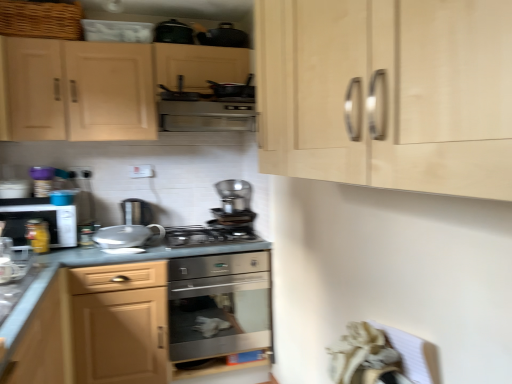
Question: Is the position of white glossy kettle at center, marked as the 1th appliance in a bottom-to-top arrangement, less distant than that of matte wood drawer at lower left, the second cabinetry ordered from the bottom?

Choices:
 (A) yes
 (B) no

Answer: (B)

Question: Is white glossy kettle at center, marked as the 1th appliance in a bottom-to-top arrangement, to the left of matte wood drawer at lower left, the second cabinetry ordered from the bottom, from the viewer's perspective?

Choices:
 (A) no
 (B) yes

Answer: (A)

Question: Is matte wood drawer at lower left, positioned as the 3th cabinetry in top-to-bottom order, a part of white glossy kettle at center, marked as the 1th appliance in a bottom-to-top arrangement?

Choices:
 (A) yes
 (B) no

Answer: (B)

Question: Does white glossy kettle at center, the fifth appliance positioned from the left, have a smaller size compared to matte wood drawer at lower left, the second cabinetry ordered from the bottom?

Choices:
 (A) no
 (B) yes

Answer: (B)

Question: Is white glossy kettle at center, which is the third appliance from right to left, turned away from matte wood drawer at lower left, positioned as the 3th cabinetry in top-to-bottom order?

Choices:
 (A) no
 (B) yes

Answer: (A)

Question: Does white glossy kettle at center, which is the third appliance from right to left, lie behind matte wood drawer at lower left, positioned as the 3th cabinetry in top-to-bottom order?

Choices:
 (A) yes
 (B) no

Answer: (A)

Question: Could you tell me if matte white microwave at left, marked as the 2th appliance in a top-to-bottom arrangement, is turned towards light wood cabinet at upper left, the fourth cabinetry positioned from the bottom?

Choices:
 (A) no
 (B) yes

Answer: (A)

Question: Is matte white microwave at left, marked as the 7th appliance in a right-to-left arrangement, taller than light wood cabinet at upper left, which appears as the first cabinetry when viewed from the top?

Choices:
 (A) no
 (B) yes

Answer: (A)

Question: Considering the relative sizes of matte white microwave at left, marked as the 1th appliance in a left-to-right arrangement, and light wood cabinet at upper left, which appears as the first cabinetry when viewed from the top, in the image provided, is matte white microwave at left, marked as the 1th appliance in a left-to-right arrangement, bigger than light wood cabinet at upper left, which appears as the first cabinetry when viewed from the top,?

Choices:
 (A) yes
 (B) no

Answer: (B)

Question: Considering the relative sizes of matte white microwave at left, marked as the 1th appliance in a left-to-right arrangement, and light wood cabinet at upper left, which appears as the first cabinetry when viewed from the top, in the image provided, is matte white microwave at left, marked as the 1th appliance in a left-to-right arrangement, thinner than light wood cabinet at upper left, which appears as the first cabinetry when viewed from the top,?

Choices:
 (A) no
 (B) yes

Answer: (B)

Question: Is matte white microwave at left, marked as the 1th appliance in a left-to-right arrangement, next to light wood cabinet at upper left, the fourth cabinetry positioned from the bottom?

Choices:
 (A) no
 (B) yes

Answer: (A)

Question: From the image's perspective, is matte white microwave at left, marked as the 1th appliance in a left-to-right arrangement, below light wood cabinet at upper left, the fourth cabinetry positioned from the bottom?

Choices:
 (A) no
 (B) yes

Answer: (B)

Question: Is matte wood drawer at lower left, positioned as the 3th cabinetry in top-to-bottom order, directly adjacent to light wood cabinet at upper left, the fourth cabinetry positioned from the bottom?

Choices:
 (A) no
 (B) yes

Answer: (A)